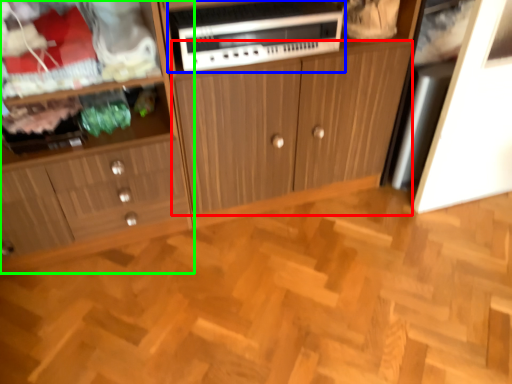
Question: Considering the real-world distances, which object is closest to cabinetry (highlighted by a red box)? home appliance (highlighted by a blue box) or cabinetry (highlighted by a green box).

Choices:
 (A) home appliance
 (B) cabinetry

Answer: (A)